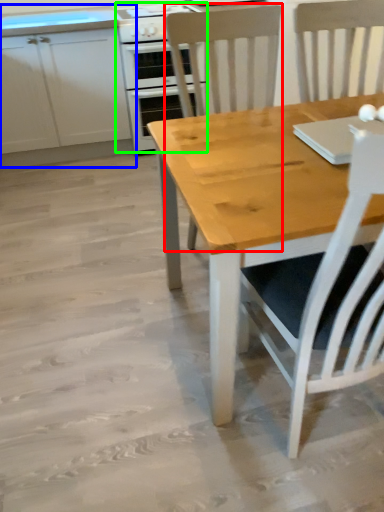
Question: Which object is positioned farthest from chair (highlighted by a red box)? Select from cabinetry (highlighted by a blue box) and kitchen appliance (highlighted by a green box).

Choices:
 (A) cabinetry
 (B) kitchen appliance

Answer: (A)